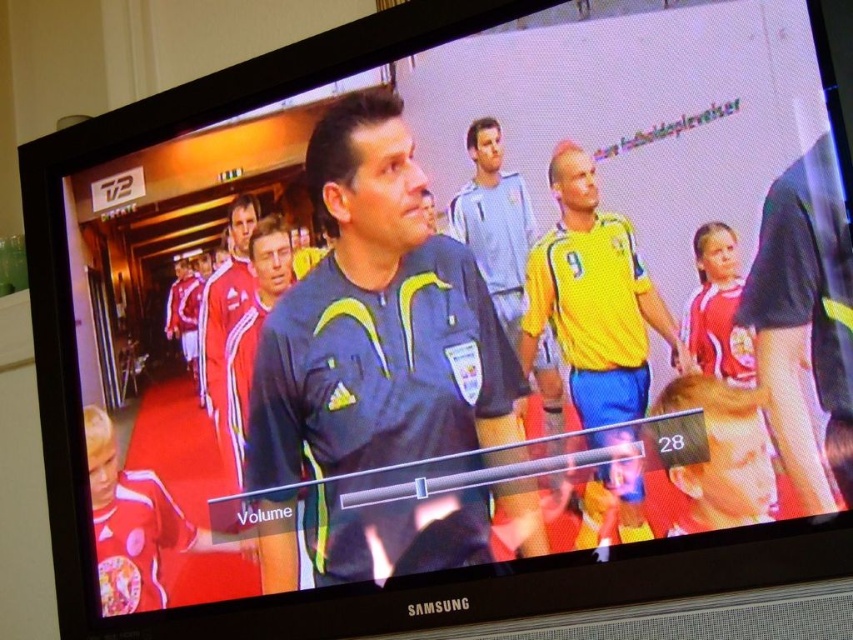
Is dark blue jersey at center to the right of yellow jersey at center from the viewer's perspective?

In fact, dark blue jersey at center is to the left of yellow jersey at center.

Who is positioned more to the right, dark blue jersey at center or yellow jersey at center?

yellow jersey at center is more to the right.

What do you see at coordinates (376, 321) in the screenshot? I see `dark blue jersey at center` at bounding box center [376, 321].

Image resolution: width=853 pixels, height=640 pixels. Identify the location of dark blue jersey at center. (376, 321).